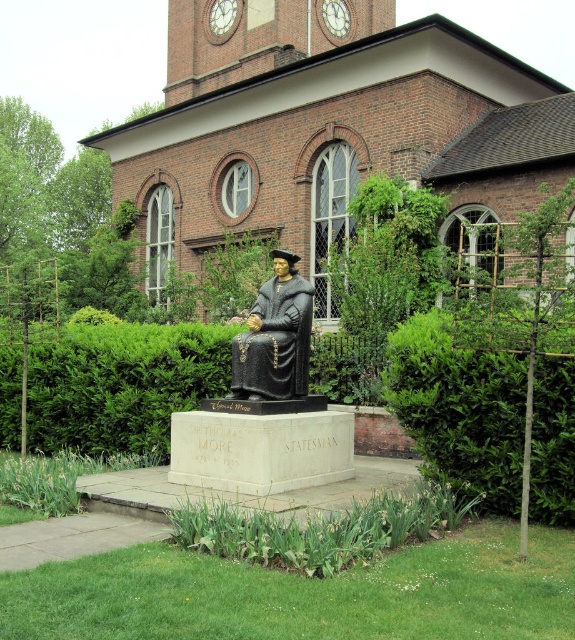
Question: Which object is positioned closest to the green leafy hedge at lower right?

Choices:
 (A) polished bronze statue at center
 (B) brown brick church at center

Answer: (A)

Question: From the image, what is the correct spatial relationship of green leafy hedge at lower right in relation to green leafy hedge at center?

Choices:
 (A) left
 (B) right

Answer: (B)

Question: Which point is farther from the camera taking this photo?

Choices:
 (A) (276, 285)
 (B) (538, 472)
 (C) (202, 214)

Answer: (C)

Question: Does brown brick church at center come in front of bronze statue at center?

Choices:
 (A) yes
 (B) no

Answer: (B)

Question: Which object is farther from the camera taking this photo?

Choices:
 (A) green leafy hedge at lower right
 (B) brown brick church at center
 (C) bronze statue at center

Answer: (B)

Question: Is green leafy hedge at lower right bigger than bronze statue at center?

Choices:
 (A) no
 (B) yes

Answer: (B)